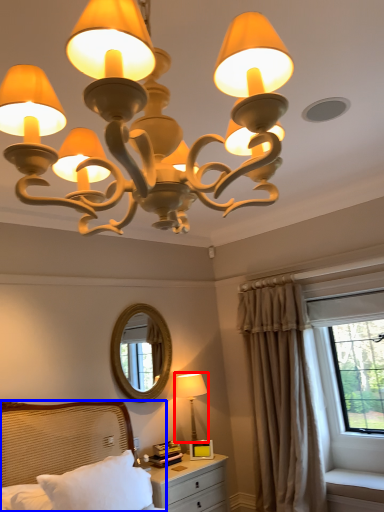
Question: Which of the following is the closest to the observer, lamp (highlighted by a red box) or bed (highlighted by a blue box)?

Choices:
 (A) lamp
 (B) bed

Answer: (B)